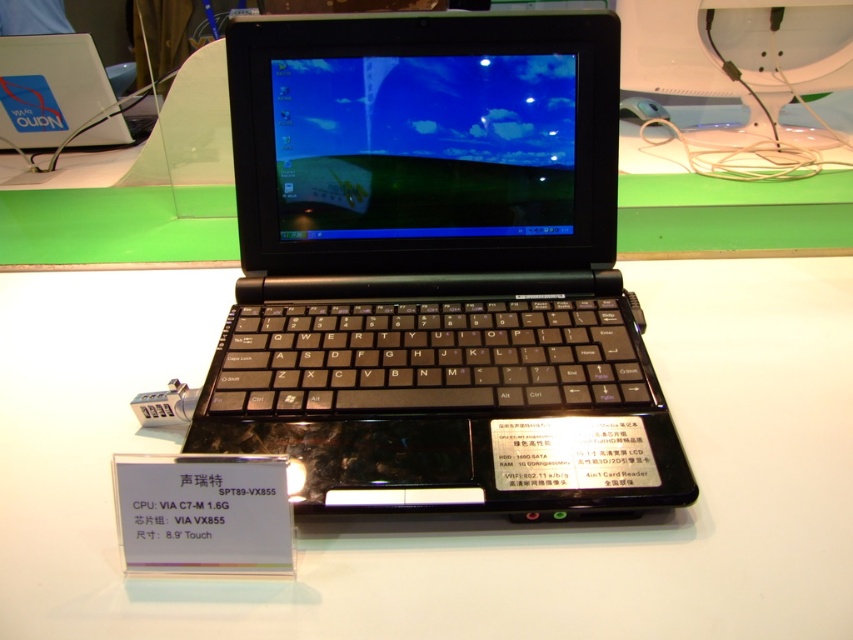
Question: Is black plastic laptop at center above black plastic table at center?

Choices:
 (A) no
 (B) yes

Answer: (B)

Question: Does black plastic laptop at center have a greater width compared to black plastic table at center?

Choices:
 (A) yes
 (B) no

Answer: (B)

Question: Which point is closer to the camera?

Choices:
 (A) (480, 227)
 (B) (234, 595)

Answer: (B)

Question: Among these points, which one is nearest to the camera?

Choices:
 (A) (260, 234)
 (B) (115, 564)

Answer: (B)

Question: Which of the following is the farthest from the observer?

Choices:
 (A) black plastic table at center
 (B) black plastic laptop at center

Answer: (B)

Question: Where is black plastic laptop at center located in relation to black plastic table at center in the image?

Choices:
 (A) left
 (B) right

Answer: (B)